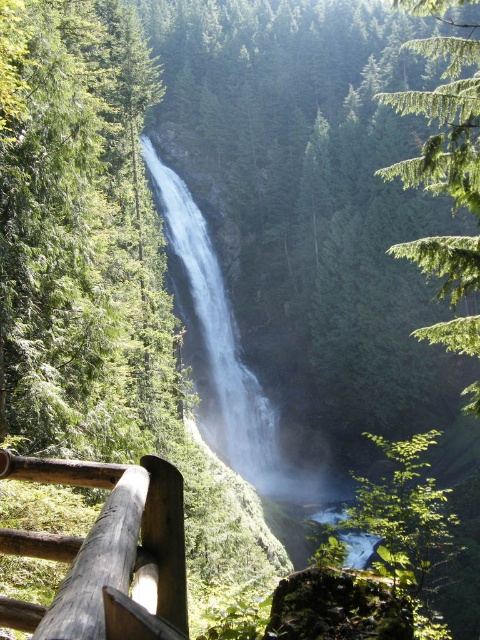
Question: Which object is positioned closest to the white smooth waterfall at center?

Choices:
 (A) green textured tree at upper right
 (B) dark brown wooden rail at lower left

Answer: (A)

Question: Where is dark brown wooden rail at lower left located in relation to green textured tree at upper right in the image?

Choices:
 (A) left
 (B) right

Answer: (A)

Question: Among these points, which one is farthest from the camera?

Choices:
 (A) (266, 432)
 (B) (71, 637)

Answer: (A)

Question: Does green textured tree at upper right have a greater width compared to white smooth waterfall at center?

Choices:
 (A) yes
 (B) no

Answer: (A)

Question: Is the position of dark brown wooden rail at lower left less distant than that of green textured tree at upper right?

Choices:
 (A) yes
 (B) no

Answer: (A)

Question: Based on their relative distances, which object is farther from the dark brown wooden rail at lower left?

Choices:
 (A) white smooth waterfall at center
 (B) green textured tree at upper right

Answer: (A)